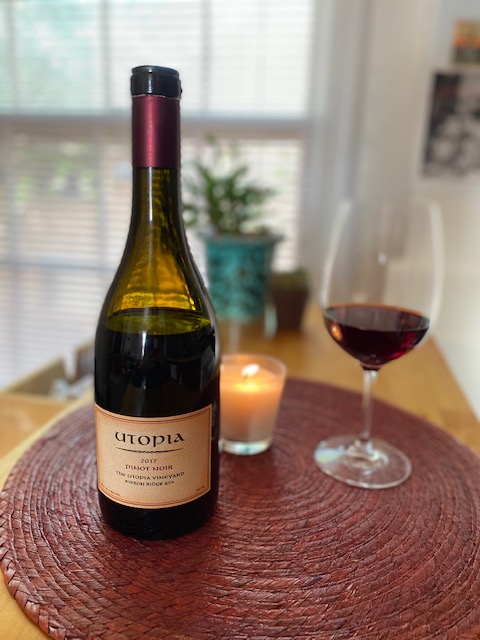
This screenshot has width=480, height=640. I want to click on plant, so click(x=223, y=198).